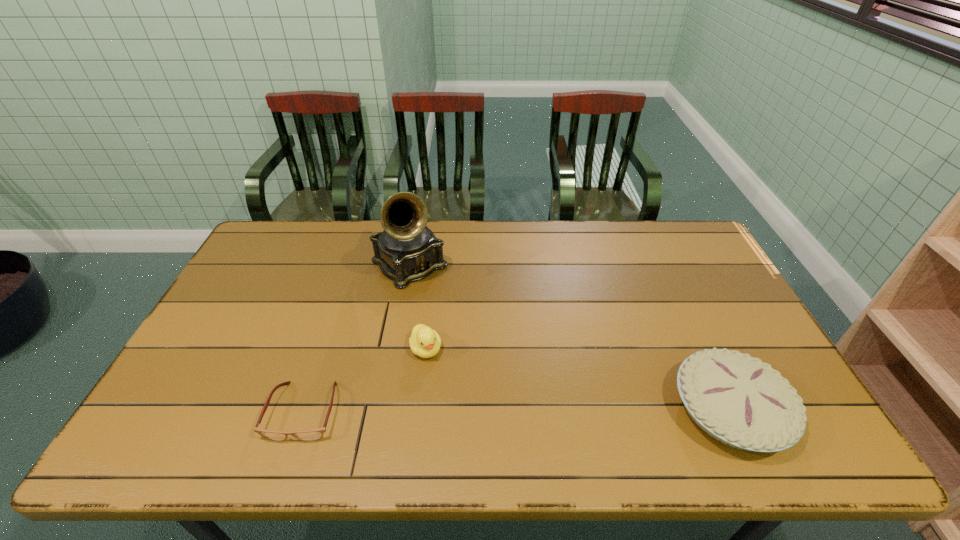
The width and height of the screenshot is (960, 540). What are the coordinates of `the shortest object` in the screenshot? It's located at (314, 434).

You are a GUI agent. You are given a task and a screenshot of the screen. Output one action in this format:
    pyautogui.click(x=<x>, y=<y>)
    Task: Click on the pie
    
    Given the screenshot: What is the action you would take?
    (x=737, y=399)

The height and width of the screenshot is (540, 960). I want to click on the tallest object, so click(407, 250).

Where is `phonograph record`? This screenshot has height=540, width=960. phonograph record is located at coordinates (407, 250).

At what (x,y) coordinates should I click in order to perform the action: click on duckling. Please return your answer as a coordinate pair (x, y). The height and width of the screenshot is (540, 960). Looking at the image, I should click on (425, 342).

Find the location of a particular element. The height and width of the screenshot is (540, 960). free spot located 0.380m on the back of the rightmost object is located at coordinates (664, 271).

The image size is (960, 540). What are the coordinates of `free space located on the horn of the tallest object` in the screenshot? It's located at (513, 371).

At what (x,y) coordinates should I click in order to perform the action: click on free space located 0.250m on the horn of the tallest object. Please return your answer as a coordinate pair (x, y). Image resolution: width=960 pixels, height=540 pixels. Looking at the image, I should click on (478, 336).

This screenshot has height=540, width=960. What are the coordinates of `free spot located 0.150m on the horn of the tallest object` in the screenshot? It's located at (458, 316).

In order to click on blank area located on the beak of the duckling in this screenshot , I will do `click(455, 410)`.